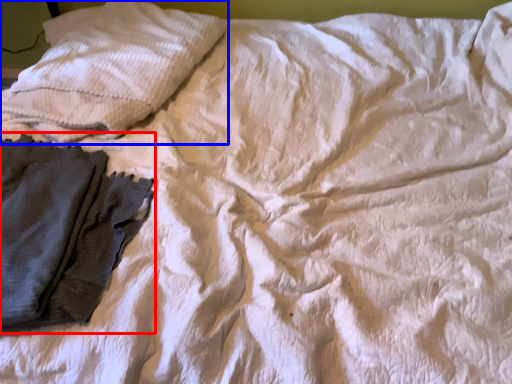
Question: Among these objects, which one is farthest to the camera, garment (highlighted by a red box) or pillow (highlighted by a blue box)?

Choices:
 (A) garment
 (B) pillow

Answer: (B)